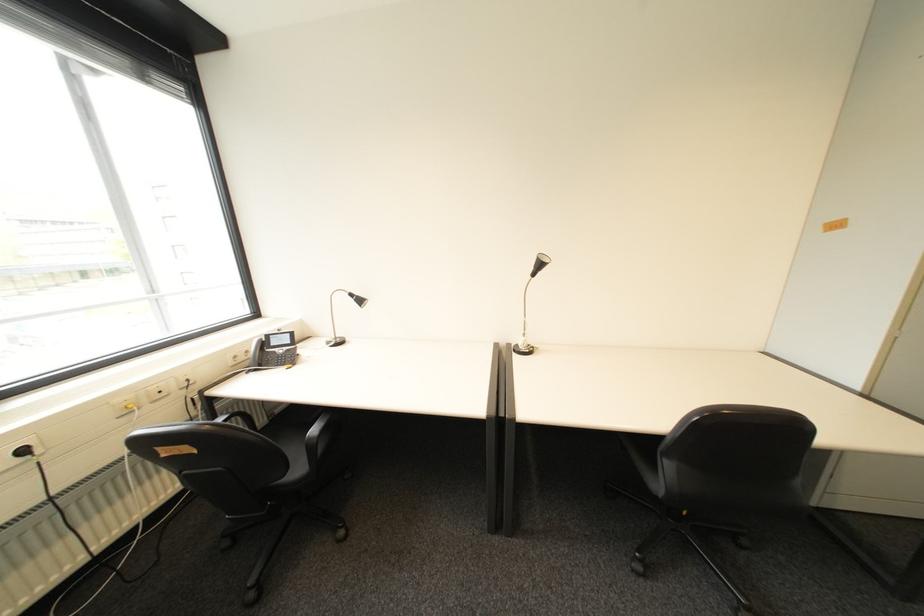
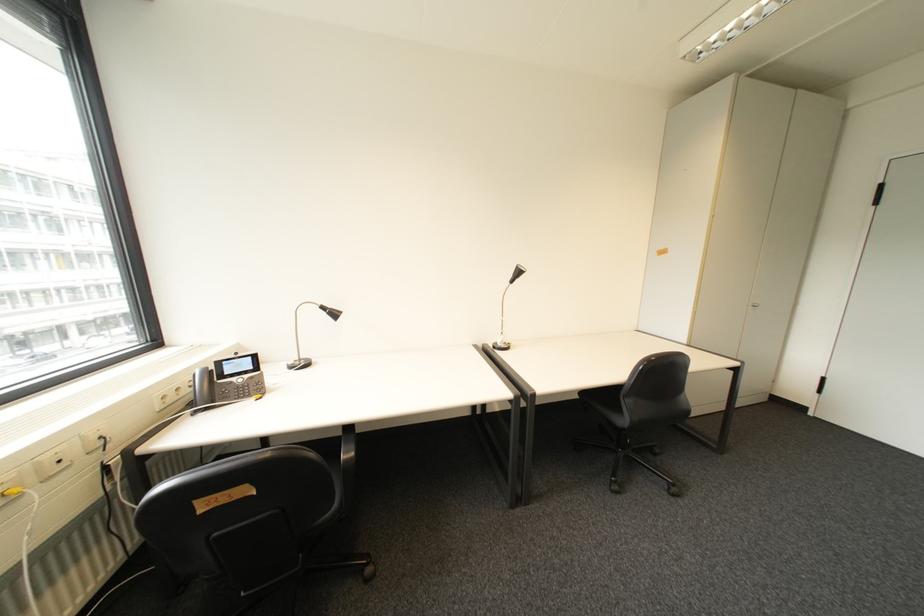
Question: What movement of the cameraman would produce the second image?

Choices:
 (A) Left
 (B) Right
 (C) Forward
 (D) Backward

Answer: (A)